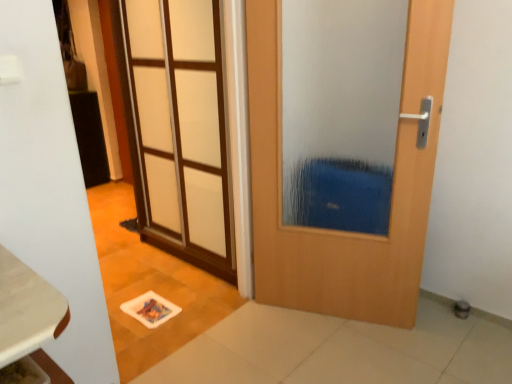
Locate an element on the screen. vacant area that is situated to the right of wooden door at center, the second door viewed from the left is located at coordinates (441, 338).